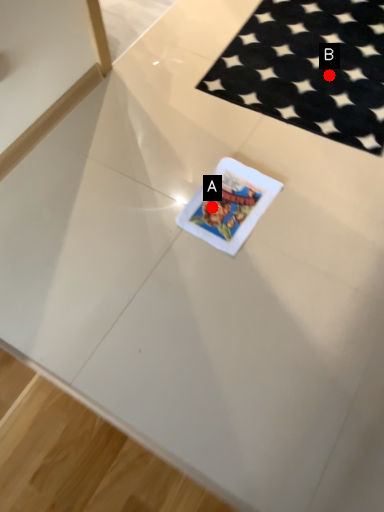
Question: Two points are circled on the image, labeled by A and B beside each circle. Which point is closer to the camera?

Choices:
 (A) A is closer
 (B) B is closer

Answer: (A)